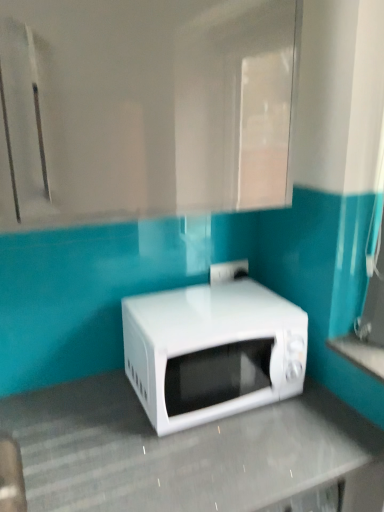
What do you see at coordinates (360, 353) in the screenshot? I see `white glossy countertop at lower right, the first counter top when ordered from top to bottom` at bounding box center [360, 353].

The width and height of the screenshot is (384, 512). I want to click on white glossy microwave at center, the 2th counter top when ordered from right to left, so click(x=188, y=452).

This screenshot has height=512, width=384. What do you see at coordinates (212, 351) in the screenshot? I see `white glossy microwave at center` at bounding box center [212, 351].

Image resolution: width=384 pixels, height=512 pixels. I want to click on white glossy countertop at lower right, the first counter top when ordered from top to bottom, so click(360, 353).

Considering the relative sizes of white glossy microwave at center, the first counter top from the bottom, and white glossy microwave at center in the image provided, is white glossy microwave at center, the first counter top from the bottom, taller than white glossy microwave at center?

Indeed, white glossy microwave at center, the first counter top from the bottom, has a greater height compared to white glossy microwave at center.

What's the angular difference between white glossy microwave at center, arranged as the 1th counter top when viewed from the left, and white glossy microwave at center's facing directions?

white glossy microwave at center, arranged as the 1th counter top when viewed from the left, and white glossy microwave at center are facing 2.86 degrees away from each other.

Based on the photo, are white glossy microwave at center, the 2th counter top when ordered from right to left, and white glossy microwave at center making contact?

There is a gap between white glossy microwave at center, the 2th counter top when ordered from right to left, and white glossy microwave at center.

Choose the correct answer: Is white glossy microwave at center, placed as the 2th counter top when sorted from top to bottom, inside white glossy microwave at center or outside it?

white glossy microwave at center, placed as the 2th counter top when sorted from top to bottom, cannot be found inside white glossy microwave at center.

From a real-world perspective, is white glossy countertop at lower right, the first counter top when ordered from top to bottom, positioned over white glossy microwave at center based on gravity?

Yes, from a real-world perspective, white glossy countertop at lower right, the first counter top when ordered from top to bottom, is over white glossy microwave at center

Does white glossy countertop at lower right, the second counter top when ordered from left to right, touch white glossy microwave at center?

No, white glossy countertop at lower right, the second counter top when ordered from left to right, is not beside white glossy microwave at center.

Is white glossy countertop at lower right, the first counter top when ordered from top to bottom, far from white glossy microwave at center, the 2th counter top when ordered from right to left?

No.

From the image's perspective, is white glossy countertop at lower right, the first counter top when ordered from top to bottom, located above or below white glossy microwave at center, placed as the 2th counter top when sorted from top to bottom?

From the image's perspective, white glossy countertop at lower right, the first counter top when ordered from top to bottom, appears above white glossy microwave at center, placed as the 2th counter top when sorted from top to bottom.

Considering the relative sizes of white glossy countertop at lower right, placed as the second counter top when sorted from bottom to top, and white glossy microwave at center, arranged as the 1th counter top when viewed from the left, in the image provided, is white glossy countertop at lower right, placed as the second counter top when sorted from bottom to top, thinner than white glossy microwave at center, arranged as the 1th counter top when viewed from the left,?

Yes, white glossy countertop at lower right, placed as the second counter top when sorted from bottom to top, is thinner than white glossy microwave at center, arranged as the 1th counter top when viewed from the left.

Considering the positions of objects white glossy countertop at lower right, the first counter top when ordered from top to bottom, and white glossy microwave at center, the 2th counter top when ordered from right to left, in the image provided, who is more to the right, white glossy countertop at lower right, the first counter top when ordered from top to bottom, or white glossy microwave at center, the 2th counter top when ordered from right to left,?

Positioned to the right is white glossy countertop at lower right, the first counter top when ordered from top to bottom.

From the image's perspective, who appears lower, white glossy microwave at center or white glossy microwave at center, the 2th counter top when ordered from right to left?

From the image's view, white glossy microwave at center, the 2th counter top when ordered from right to left, is below.

Between white glossy microwave at center and white glossy microwave at center, placed as the 2th counter top when sorted from top to bottom, which one has larger width?

With larger width is white glossy microwave at center, placed as the 2th counter top when sorted from top to bottom.

Is white glossy microwave at center not near white glossy microwave at center, the 2th counter top when ordered from right to left?

white glossy microwave at center is near white glossy microwave at center, the 2th counter top when ordered from right to left, not far away.

Is white glossy microwave at center, arranged as the 1th counter top when viewed from the left, spatially inside white glossy countertop at lower right, the first counter top when ordered from top to bottom, or outside of it?

white glossy microwave at center, arranged as the 1th counter top when viewed from the left, is located beyond the bounds of white glossy countertop at lower right, the first counter top when ordered from top to bottom.

Considering the sizes of objects white glossy microwave at center, placed as the 2th counter top when sorted from top to bottom, and white glossy countertop at lower right, placed as the second counter top when sorted from bottom to top, in the image provided, who is bigger, white glossy microwave at center, placed as the 2th counter top when sorted from top to bottom, or white glossy countertop at lower right, placed as the second counter top when sorted from bottom to top,?

white glossy microwave at center, placed as the 2th counter top when sorted from top to bottom.

Is white glossy microwave at center, the 2th counter top when ordered from right to left, closer to the viewer compared to white glossy countertop at lower right, placed as the second counter top when sorted from bottom to top?

Yes, it is in front of white glossy countertop at lower right, placed as the second counter top when sorted from bottom to top.

Find the location of a particular element. This screenshot has width=384, height=512. counter top lying below the white glossy countertop at lower right, the second counter top when ordered from left to right (from the image's perspective) is located at coordinates (188, 452).

Is white glossy microwave at center thinner than white glossy countertop at lower right, the second counter top when ordered from left to right?

In fact, white glossy microwave at center might be wider than white glossy countertop at lower right, the second counter top when ordered from left to right.

Between white glossy microwave at center and white glossy countertop at lower right, which is counted as the 1th counter top, starting from the right, which one appears on the left side from the viewer's perspective?

white glossy microwave at center is more to the left.

Considering the relative sizes of white glossy microwave at center and white glossy countertop at lower right, the first counter top when ordered from top to bottom, in the image provided, is white glossy microwave at center shorter than white glossy countertop at lower right, the first counter top when ordered from top to bottom,?

Incorrect, the height of white glossy microwave at center does not fall short of that of white glossy countertop at lower right, the first counter top when ordered from top to bottom.

Locate an element on the screen. The image size is (384, 512). counter top that is the 2nd one when counting downward from the white glossy microwave at center (from the image's perspective) is located at coordinates tap(188, 452).

In the image, there is a white glossy countertop at lower right, the second counter top when ordered from left to right. Where is `microwave oven above it (from the image's perspective)`? microwave oven above it (from the image's perspective) is located at coordinates (212, 351).

When comparing their distances from white glossy countertop at lower right, which is counted as the 1th counter top, starting from the right, does white glossy microwave at center, placed as the 2th counter top when sorted from top to bottom, or white glossy microwave at center seem closer?

white glossy microwave at center lies closer to white glossy countertop at lower right, which is counted as the 1th counter top, starting from the right, than the other object.

Looking at the image, which one is located further to white glossy microwave at center, white glossy countertop at lower right, the second counter top when ordered from left to right, or white glossy microwave at center, placed as the 2th counter top when sorted from top to bottom?

Based on the image, white glossy countertop at lower right, the second counter top when ordered from left to right, appears to be further to white glossy microwave at center.

Which object lies further to the anchor point white glossy microwave at center, white glossy microwave at center, placed as the 2th counter top when sorted from top to bottom, or white glossy countertop at lower right, the first counter top when ordered from top to bottom?

Based on the image, white glossy countertop at lower right, the first counter top when ordered from top to bottom, appears to be further to white glossy microwave at center.

Based on the photo, considering their positions, is white glossy microwave at center positioned closer to white glossy microwave at center, the 2th counter top when ordered from right to left, than white glossy countertop at lower right, the second counter top when ordered from left to right?

white glossy microwave at center is positioned closer to the anchor white glossy microwave at center, the 2th counter top when ordered from right to left.

From the image, which object appears to be farther from white glossy microwave at center, placed as the 2th counter top when sorted from top to bottom, white glossy countertop at lower right, the second counter top when ordered from left to right, or white glossy microwave at center?

white glossy countertop at lower right, the second counter top when ordered from left to right.

When comparing their distances from white glossy countertop at lower right, which is counted as the 1th counter top, starting from the right, does white glossy microwave at center or white glossy microwave at center, the first counter top from the bottom, seem further?

white glossy microwave at center, the first counter top from the bottom, is positioned further to the anchor white glossy countertop at lower right, which is counted as the 1th counter top, starting from the right.

Locate an element on the screen. microwave oven located between white glossy microwave at center, placed as the 2th counter top when sorted from top to bottom, and white glossy countertop at lower right, which is counted as the 1th counter top, starting from the right, in the left-right direction is located at coordinates pyautogui.click(x=212, y=351).